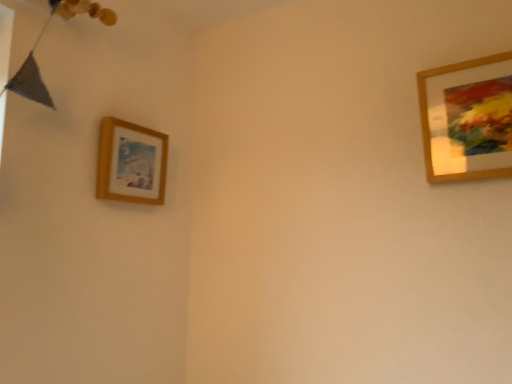
Question: Does wooden picture frame at upper left, which is counted as the first picture frame, starting from the left, lie behind wooden picture frame at upper right, placed as the 1th picture frame when sorted from right to left?

Choices:
 (A) no
 (B) yes

Answer: (B)

Question: From a real-world perspective, is wooden picture frame at upper left, placed as the 1th picture frame when sorted from back to front, located beneath wooden picture frame at upper right, positioned as the second picture frame in left-to-right order?

Choices:
 (A) yes
 (B) no

Answer: (A)

Question: Would you say wooden picture frame at upper left, the second picture frame viewed from the front, is outside wooden picture frame at upper right, placed as the 1th picture frame when sorted from right to left?

Choices:
 (A) yes
 (B) no

Answer: (A)

Question: Does wooden picture frame at upper left, the second picture frame viewed from the front, have a larger size compared to wooden picture frame at upper right, placed as the 1th picture frame when sorted from right to left?

Choices:
 (A) yes
 (B) no

Answer: (B)

Question: Does wooden picture frame at upper left, placed as the 1th picture frame when sorted from back to front, have a lesser width compared to wooden picture frame at upper right, positioned as the second picture frame in left-to-right order?

Choices:
 (A) yes
 (B) no

Answer: (B)

Question: From a real-world perspective, does wooden picture frame at upper left, placed as the 1th picture frame when sorted from back to front, stand above wooden picture frame at upper right, positioned as the second picture frame in left-to-right order?

Choices:
 (A) no
 (B) yes

Answer: (A)

Question: Does wooden picture frame at upper right, acting as the second picture frame starting from the back, have a greater width compared to wooden picture frame at upper left, which is counted as the first picture frame, starting from the left?

Choices:
 (A) yes
 (B) no

Answer: (B)

Question: Does wooden picture frame at upper right, acting as the second picture frame starting from the back, lie in front of wooden picture frame at upper left, placed as the 1th picture frame when sorted from back to front?

Choices:
 (A) yes
 (B) no

Answer: (A)

Question: Considering the relative sizes of wooden picture frame at upper right, placed as the 1th picture frame when sorted from right to left, and wooden picture frame at upper left, placed as the 1th picture frame when sorted from back to front, in the image provided, is wooden picture frame at upper right, placed as the 1th picture frame when sorted from right to left, taller than wooden picture frame at upper left, placed as the 1th picture frame when sorted from back to front,?

Choices:
 (A) no
 (B) yes

Answer: (B)

Question: Can you confirm if wooden picture frame at upper right, acting as the second picture frame starting from the back, is shorter than wooden picture frame at upper left, placed as the 1th picture frame when sorted from back to front?

Choices:
 (A) yes
 (B) no

Answer: (B)

Question: Would you say wooden picture frame at upper right, positioned as the second picture frame in left-to-right order, is a long distance from wooden picture frame at upper left, arranged as the 2th picture frame when viewed from the right?

Choices:
 (A) yes
 (B) no

Answer: (B)

Question: Would you say wooden picture frame at upper right, acting as the first picture frame starting from the front, contains wooden picture frame at upper left, arranged as the 2th picture frame when viewed from the right?

Choices:
 (A) no
 (B) yes

Answer: (A)

Question: Choose the correct answer: Is wooden picture frame at upper right, placed as the 1th picture frame when sorted from right to left, inside wooden picture frame at upper left, the second picture frame viewed from the front, or outside it?

Choices:
 (A) inside
 (B) outside

Answer: (B)